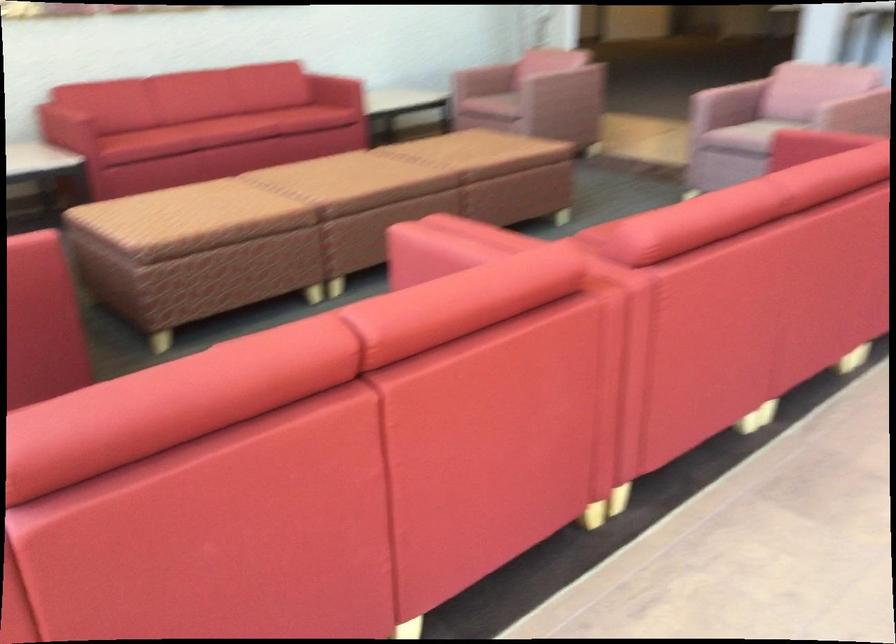
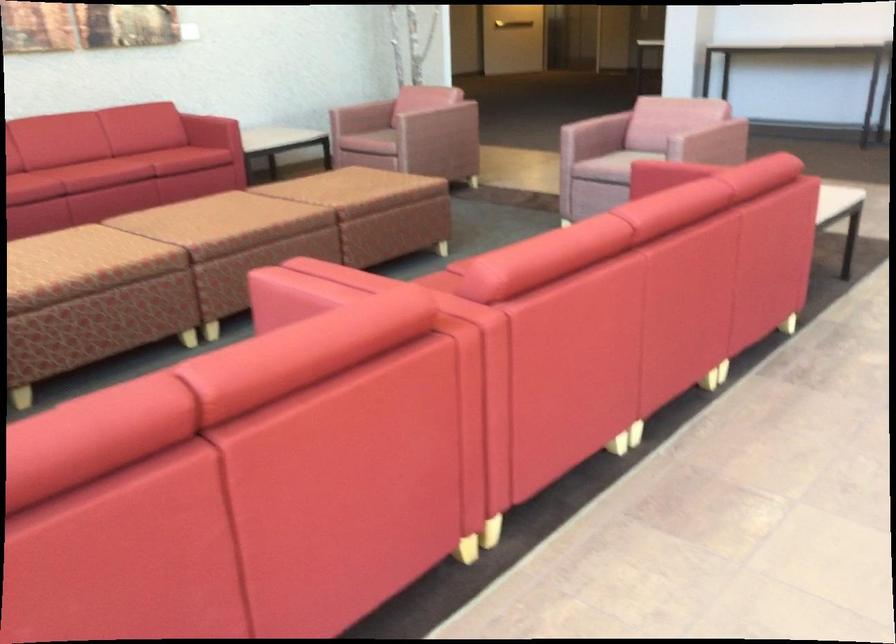
In the second image, find the point that corresponds to point 745,138 in the first image.

(615, 166)